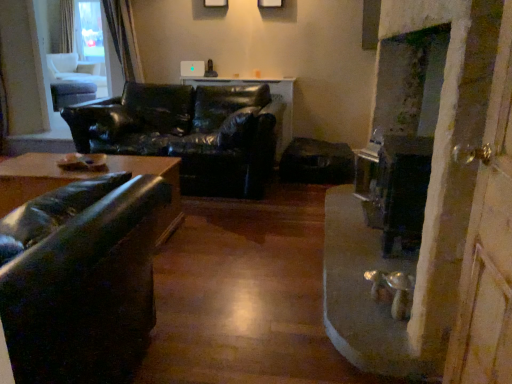
Question: Relative to matte black coffee table at center, is wooden screen door at right in front or behind?

Choices:
 (A) front
 (B) behind

Answer: (A)

Question: Is point (465, 301) positioned closer to the camera than point (88, 89)?

Choices:
 (A) farther
 (B) closer

Answer: (B)

Question: Estimate the real-world distances between objects in this image. Which object is closer to the black leather couch at center, the 2th studio couch when ordered from front to back?

Choices:
 (A) matte black coffee table at center
 (B) wooden screen door at right
 (C) matte black couch at left, acting as the first studio couch starting from the front

Answer: (C)

Question: Estimate the real-world distances between objects in this image. Which object is farther from the wooden screen door at right?

Choices:
 (A) matte black couch at left, arranged as the second studio couch when viewed from the back
 (B) matte black coffee table at center
 (C) black leather couch at center, placed as the 1th studio couch when sorted from back to front

Answer: (B)